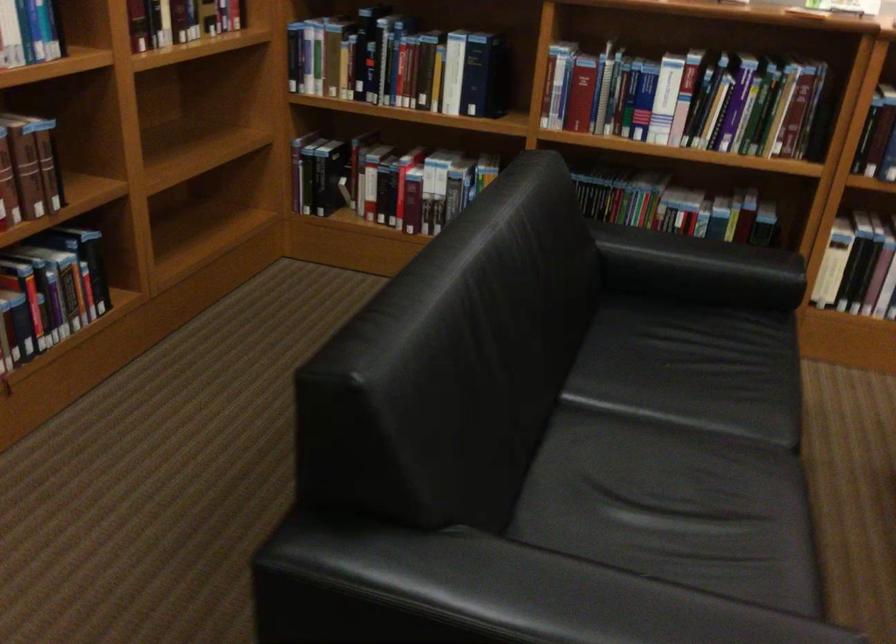
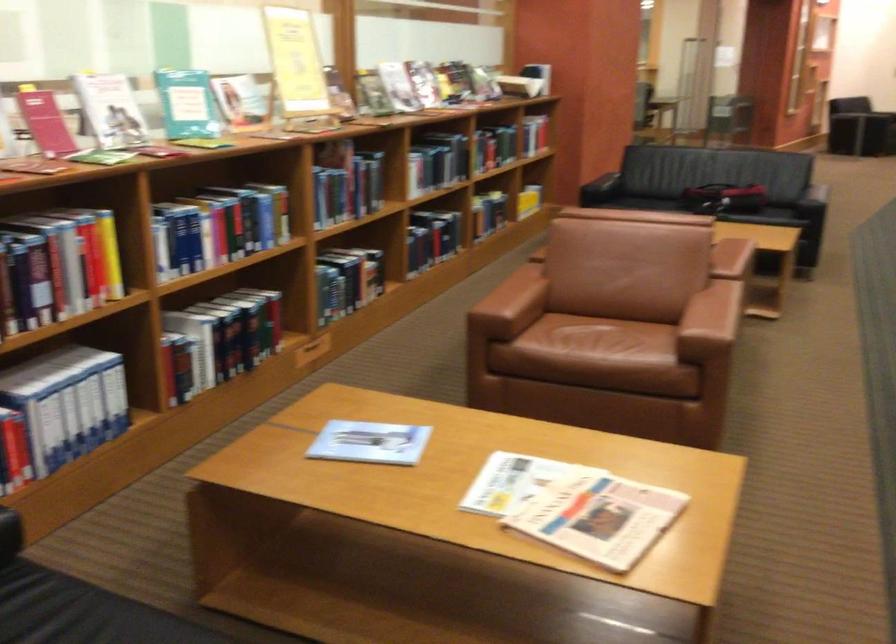
Question: How did the camera likely rotate?

Choices:
 (A) Left
 (B) Right
 (C) Up
 (D) Down

Answer: (B)